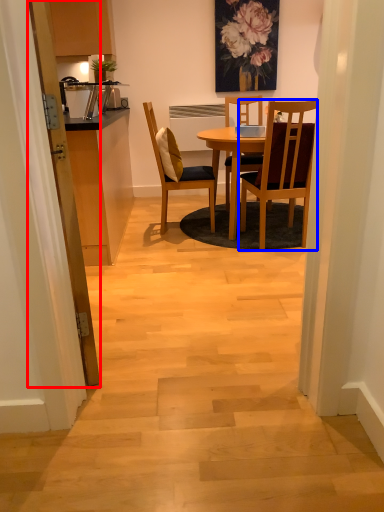
Question: Which object appears closest to the camera in this image, door (highlighted by a red box) or chair (highlighted by a blue box)?

Choices:
 (A) door
 (B) chair

Answer: (A)